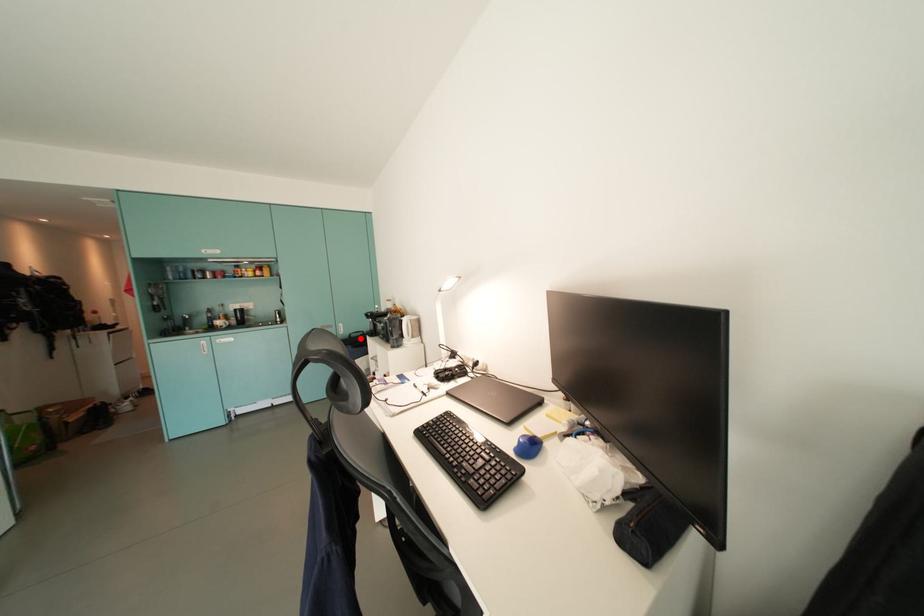
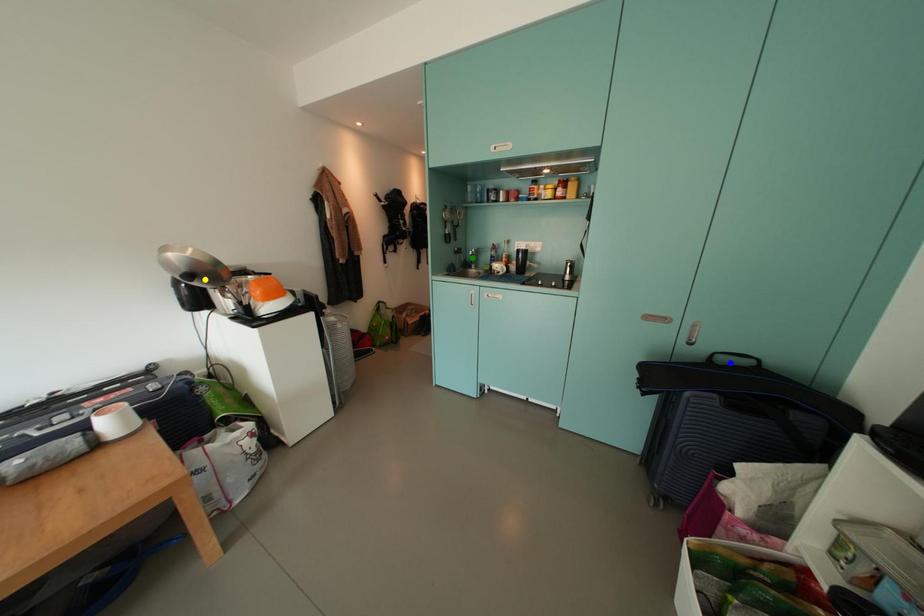
Question: I am providing you with two images of the same scene from different viewpoints. A red point is marked on the first image. You are given multiple points on the second image. Which point in image 2 represents the same 3d spot as the red point in image 1?

Choices:
 (A) green point
 (B) yellow point
 (C) blue point

Answer: (C)